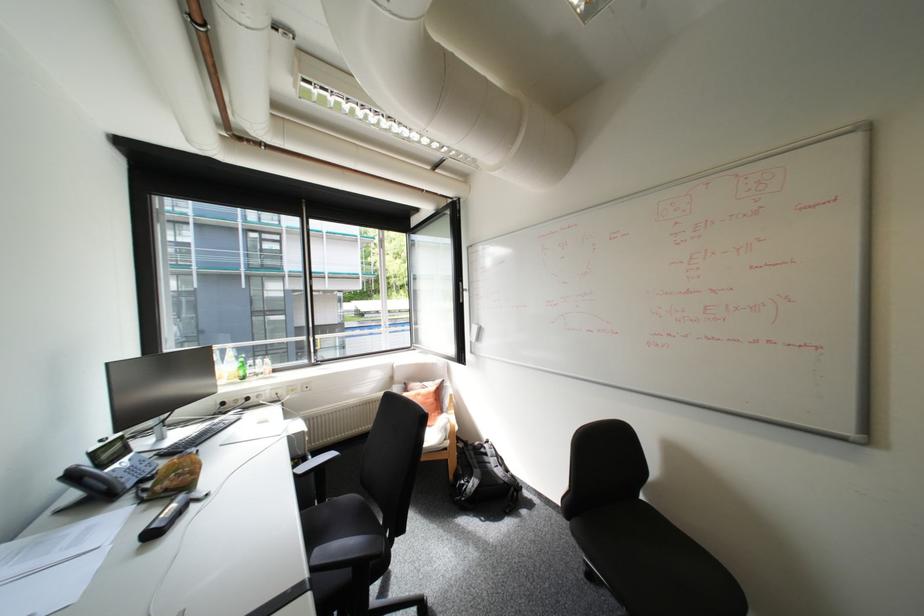
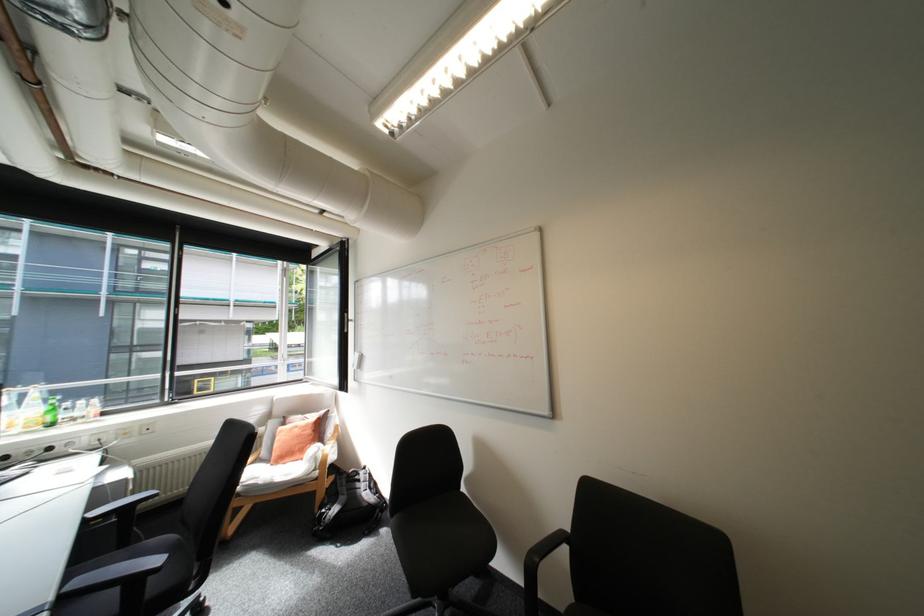
The images are taken continuously from a first-person perspective. In which direction are you moving?

The movement direction of the cameraman is right, backward.